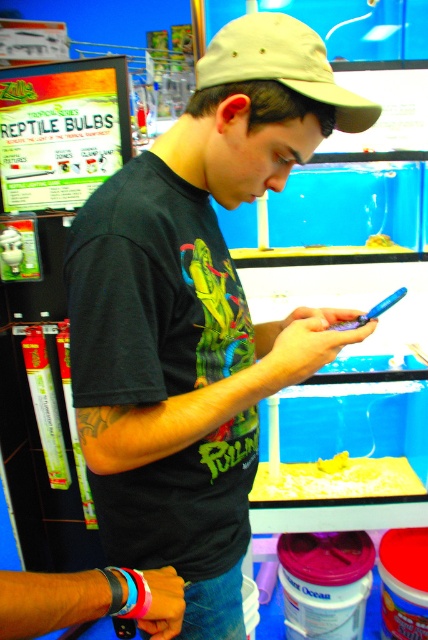
Does black matte t-shirt at center have a smaller size compared to beige fabric baseball cap at center?

No.

The image size is (428, 640). Identify the location of black matte t-shirt at center. (196, 314).

The width and height of the screenshot is (428, 640). Find the location of `black matte t-shirt at center`. black matte t-shirt at center is located at coordinates (196, 314).

This screenshot has height=640, width=428. I want to click on black matte t-shirt at center, so click(196, 314).

I want to click on black matte t-shirt at center, so click(x=196, y=314).

Image resolution: width=428 pixels, height=640 pixels. Identify the location of black matte t-shirt at center. (196, 314).

Measure the distance between beige fabric baseball cap at center and yellow sand at lower center.

beige fabric baseball cap at center and yellow sand at lower center are 1.38 meters apart.

Between beige fabric baseball cap at center and yellow sand at lower center, which one is positioned higher?

Positioned higher is beige fabric baseball cap at center.

The height and width of the screenshot is (640, 428). What do you see at coordinates (282, 65) in the screenshot?
I see `beige fabric baseball cap at center` at bounding box center [282, 65].

Where is `beige fabric baseball cap at center`? Image resolution: width=428 pixels, height=640 pixels. beige fabric baseball cap at center is located at coordinates (282, 65).